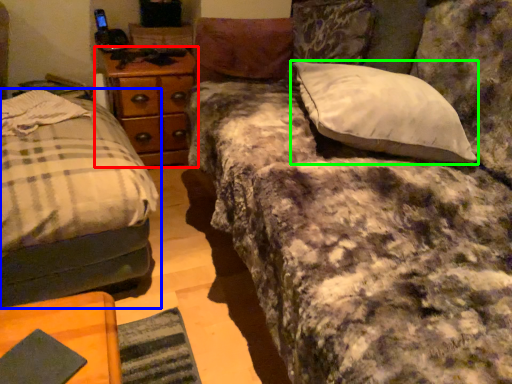
Question: Considering the real-world distances, which object is farthest from nightstand (highlighted by a red box)? bed (highlighted by a blue box) or pillow (highlighted by a green box)?

Choices:
 (A) bed
 (B) pillow

Answer: (B)